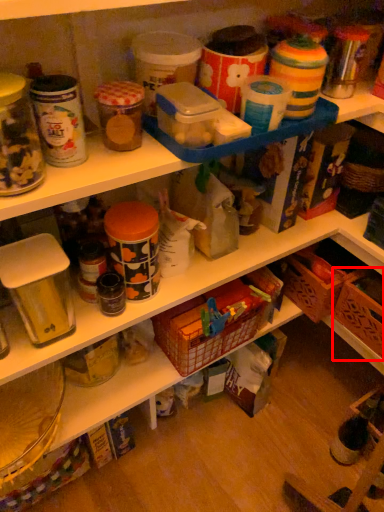
Question: Where is basket (annotated by the red box) located in relation to basket in the image?

Choices:
 (A) left
 (B) right

Answer: (B)